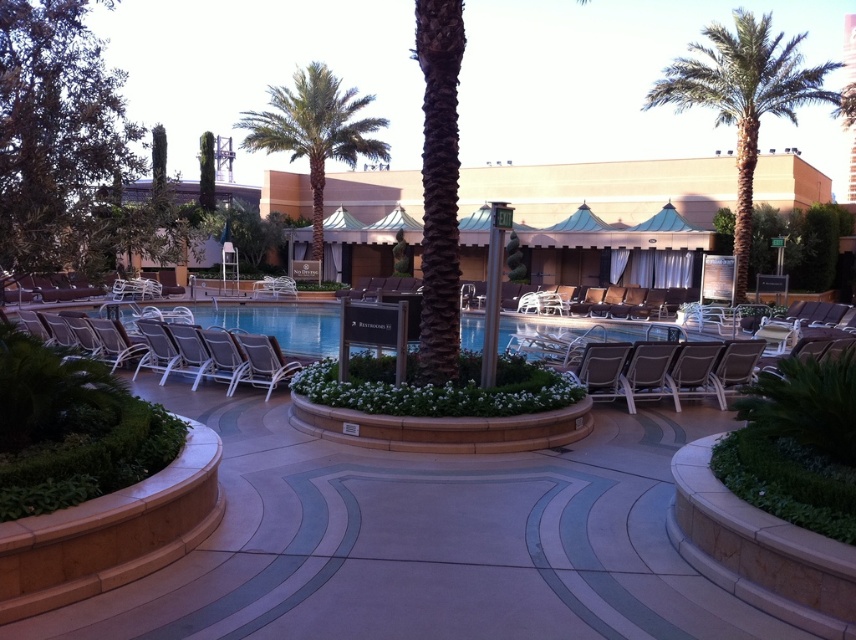
You are standing at the edge of the pool and want to take a photo of the beige concrete resort at center and the metallic silver lounge chair at right. Which object should you focus on first if you want to capture both in a single frame without moving the camera?

You should focus on the beige concrete resort at center first because it is above the metallic silver lounge chair at right, so adjusting the camera to include the higher object first will ensure both are in frame.